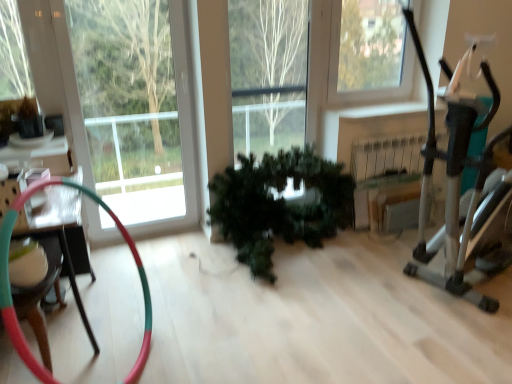
Question: Considering the relative positions of green matte plant at center and metallic silver exercise machine at right in the image provided, is green matte plant at center to the right of metallic silver exercise machine at right from the viewer's perspective?

Choices:
 (A) yes
 (B) no

Answer: (B)

Question: Can we say green matte plant at center lies outside metallic silver exercise machine at right?

Choices:
 (A) no
 (B) yes

Answer: (B)

Question: From a real-world perspective, is green matte plant at center positioned over metallic silver exercise machine at right based on gravity?

Choices:
 (A) yes
 (B) no

Answer: (B)

Question: Is green matte plant at center thinner than metallic silver exercise machine at right?

Choices:
 (A) yes
 (B) no

Answer: (A)

Question: Considering the relative sizes of green matte plant at center and metallic silver exercise machine at right in the image provided, is green matte plant at center taller than metallic silver exercise machine at right?

Choices:
 (A) yes
 (B) no

Answer: (B)

Question: Does green matte plant at center have a greater width compared to metallic silver exercise machine at right?

Choices:
 (A) no
 (B) yes

Answer: (A)

Question: Can you confirm if metallic silver exercise machine at right is smaller than green matte plant at center?

Choices:
 (A) no
 (B) yes

Answer: (A)

Question: Is metallic silver exercise machine at right turned away from green matte plant at center?

Choices:
 (A) yes
 (B) no

Answer: (B)

Question: Can you confirm if metallic silver exercise machine at right is positioned to the right of green matte plant at center?

Choices:
 (A) no
 (B) yes

Answer: (B)

Question: Can you confirm if metallic silver exercise machine at right is bigger than green matte plant at center?

Choices:
 (A) yes
 (B) no

Answer: (A)

Question: Is metallic silver exercise machine at right not near green matte plant at center?

Choices:
 (A) yes
 (B) no

Answer: (B)

Question: Is green matte plant at center a part of metallic silver exercise machine at right?

Choices:
 (A) yes
 (B) no

Answer: (B)

Question: Is the depth of multicolored rubber hose at left greater than that of green matte plant at center?

Choices:
 (A) no
 (B) yes

Answer: (A)